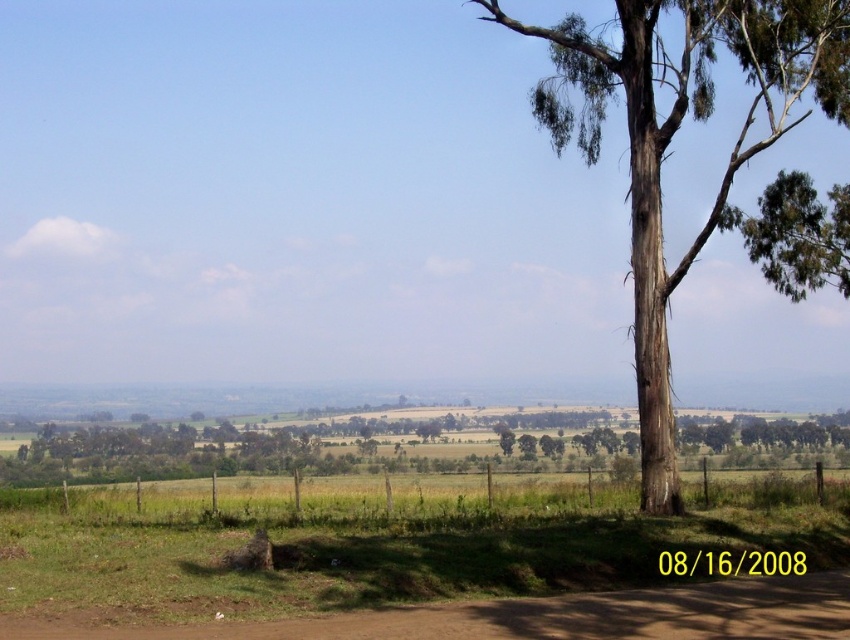
How distant is green bark tree at right from green leafy tree at upper right?

green bark tree at right and green leafy tree at upper right are 18.46 feet apart.

Can you confirm if green bark tree at right is wider than green leafy tree at upper right?

Correct, the width of green bark tree at right exceeds that of green leafy tree at upper right.

Between point (649, 33) and point (789, 184), which one is positioned behind?

The point (789, 184) is behind.

Find the location of a particular element. green bark tree at right is located at coordinates (724, 168).

Is green bark tree at right behind brown dirt track at lower center?

Yes, it is.

Is green bark tree at right bigger than brown dirt track at lower center?

Indeed, green bark tree at right has a larger size compared to brown dirt track at lower center.

Who is more distant from viewer, (683, 6) or (710, 621)?

Positioned behind is point (683, 6).

At what (x,y) coordinates should I click in order to perform the action: click on green bark tree at right. Please return your answer as a coordinate pair (x, y). The width and height of the screenshot is (850, 640). Looking at the image, I should click on (724, 168).

Can you confirm if brown dirt track at lower center is taller than green leafy tree at upper right?

No, brown dirt track at lower center is not taller than green leafy tree at upper right.

Identify the location of brown dirt track at lower center. This screenshot has width=850, height=640. (530, 616).